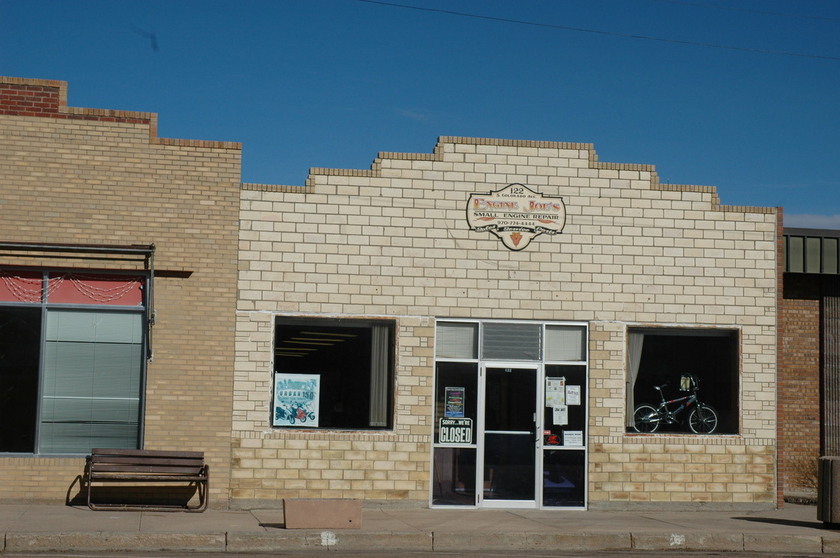
What are the coordinates of `poster` in the screenshot? It's located at (296, 403).